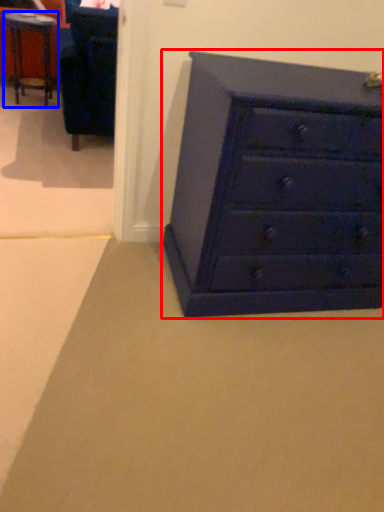
Question: Which object is further to the camera taking this photo, chest of drawers (highlighted by a red box) or table (highlighted by a blue box)?

Choices:
 (A) chest of drawers
 (B) table

Answer: (B)